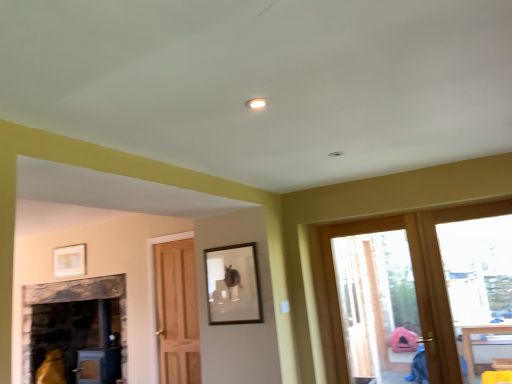
How much space does matte black picture frame at center, which ranks as the 2th picture frame in left-to-right order, occupy horizontally?

4.21 centimeters.

You are a GUI agent. You are given a task and a screenshot of the screen. Output one action in this format:
    pyautogui.click(x=<x>, y=<y>)
    Task: Click on the matte white picture frame at upper left, the 2th picture frame viewed from the right
    
    Given the screenshot: What is the action you would take?
    pyautogui.click(x=69, y=260)

This screenshot has width=512, height=384. What do you see at coordinates (479, 287) in the screenshot? I see `clear glass door at right, positioned as the 1th window in right-to-left order` at bounding box center [479, 287].

Where is `matte black picture frame at center, the first picture frame viewed from the right`? The height and width of the screenshot is (384, 512). matte black picture frame at center, the first picture frame viewed from the right is located at coordinates (233, 284).

Is clear glass door at right, which is the 2th window in left-to-right order, positioned far away from matte white picture frame at upper left, marked as the 2th picture frame in a front-to-back arrangement?

Yes, clear glass door at right, which is the 2th window in left-to-right order, is far from matte white picture frame at upper left, marked as the 2th picture frame in a front-to-back arrangement.

Which object is closer to the camera, clear glass door at right, positioned as the 1th window in right-to-left order, or matte white picture frame at upper left, placed as the first picture frame when sorted from back to front?

clear glass door at right, positioned as the 1th window in right-to-left order.

Image resolution: width=512 pixels, height=384 pixels. Identify the location of picture frame that is below the clear glass door at right, positioned as the 1th window in right-to-left order (from the image's perspective). (69, 260).

Considering the relative positions of transparent glass door at right, acting as the second window starting from the right, and matte white picture frame at upper left, placed as the first picture frame when sorted from back to front, in the image provided, is transparent glass door at right, acting as the second window starting from the right, to the left of matte white picture frame at upper left, placed as the first picture frame when sorted from back to front, from the viewer's perspective?

In fact, transparent glass door at right, acting as the second window starting from the right, is to the right of matte white picture frame at upper left, placed as the first picture frame when sorted from back to front.

Between point (418, 317) and point (85, 250), which one is positioned behind?

The point (85, 250) is farther.

Consider the image. Is transparent glass door at right, acting as the second window starting from the right, smaller than matte white picture frame at upper left, the 2th picture frame viewed from the right?

Incorrect, transparent glass door at right, acting as the second window starting from the right, is not smaller in size than matte white picture frame at upper left, the 2th picture frame viewed from the right.

At what (x,y) coordinates should I click in order to perform the action: click on the 2nd picture frame to the left of the transparent glass door at right, acting as the second window starting from the right, counting from the anchor's position. Please return your answer as a coordinate pair (x, y). Looking at the image, I should click on 69,260.

From a real-world perspective, is matte white picture frame at upper left, placed as the first picture frame when sorted from back to front, above or below matte black picture frame at center, the first picture frame viewed from the right?

matte white picture frame at upper left, placed as the first picture frame when sorted from back to front, is situated higher than matte black picture frame at center, the first picture frame viewed from the right, in the real world.

Consider the image. From their relative heights in the image, would you say matte white picture frame at upper left, which is counted as the 1th picture frame, starting from the left, is taller or shorter than matte black picture frame at center, the first picture frame viewed from the right?

In the image, matte white picture frame at upper left, which is counted as the 1th picture frame, starting from the left, appears to be shorter than matte black picture frame at center, the first picture frame viewed from the right.

Could you tell me if matte white picture frame at upper left, marked as the 2th picture frame in a front-to-back arrangement, is facing matte black picture frame at center, the first picture frame viewed from the right?

No, matte white picture frame at upper left, marked as the 2th picture frame in a front-to-back arrangement, is not turned towards matte black picture frame at center, the first picture frame viewed from the right.

Is matte white picture frame at upper left, the 2th picture frame viewed from the right, in contact with matte black picture frame at center, which ranks as the 2th picture frame in left-to-right order?

No, matte white picture frame at upper left, the 2th picture frame viewed from the right, is not with matte black picture frame at center, which ranks as the 2th picture frame in left-to-right order.

Who is bigger, matte white picture frame at upper left, placed as the first picture frame when sorted from back to front, or transparent glass door at right, acting as the second window starting from the right?

transparent glass door at right, acting as the second window starting from the right.

Considering the sizes of objects matte white picture frame at upper left, marked as the 2th picture frame in a front-to-back arrangement, and transparent glass door at right, acting as the second window starting from the right, in the image provided, who is thinner, matte white picture frame at upper left, marked as the 2th picture frame in a front-to-back arrangement, or transparent glass door at right, acting as the second window starting from the right,?

matte white picture frame at upper left, marked as the 2th picture frame in a front-to-back arrangement.

Based on the photo, is matte white picture frame at upper left, which is counted as the 1th picture frame, starting from the left, at the left side of transparent glass door at right, acting as the second window starting from the right?

Indeed, matte white picture frame at upper left, which is counted as the 1th picture frame, starting from the left, is positioned on the left side of transparent glass door at right, acting as the second window starting from the right.

Is matte white picture frame at upper left, marked as the 2th picture frame in a front-to-back arrangement, facing away from transparent glass door at right, acting as the second window starting from the right?

No, matte white picture frame at upper left, marked as the 2th picture frame in a front-to-back arrangement,'s orientation is not away from transparent glass door at right, acting as the second window starting from the right.

Is the depth of matte black picture frame at center, the first picture frame viewed from the right, less than that of matte white picture frame at upper left, the 2th picture frame viewed from the right?

Result: Yes, matte black picture frame at center, the first picture frame viewed from the right, is closer to the camera.

Is matte black picture frame at center, the second picture frame from the back, positioned far away from matte white picture frame at upper left, which is counted as the 1th picture frame, starting from the left?

matte black picture frame at center, the second picture frame from the back, is far away from matte white picture frame at upper left, which is counted as the 1th picture frame, starting from the left.

Based on the photo, is matte black picture frame at center, the first picture frame viewed from the right, to the left or to the right of matte white picture frame at upper left, marked as the 2th picture frame in a front-to-back arrangement, in the image?

In the image, matte black picture frame at center, the first picture frame viewed from the right, appears on the right side of matte white picture frame at upper left, marked as the 2th picture frame in a front-to-back arrangement.

From a real-world perspective, which is physically below, matte black picture frame at center, the second picture frame from the back, or matte white picture frame at upper left, which is counted as the 1th picture frame, starting from the left?

matte black picture frame at center, the second picture frame from the back, from a real-world perspective.

Is the position of transparent glass door at right, acting as the second window starting from the right, less distant than that of clear glass door at right, which is the 2th window in left-to-right order?

Yes, transparent glass door at right, acting as the second window starting from the right, is closer to the camera.

Is transparent glass door at right, the first window from the left, facing towards clear glass door at right, which is the 2th window in left-to-right order?

Yes, transparent glass door at right, the first window from the left, is facing clear glass door at right, which is the 2th window in left-to-right order.

Which is more to the left, transparent glass door at right, the first window from the left, or clear glass door at right, positioned as the 1th window in right-to-left order?

From the viewer's perspective, transparent glass door at right, the first window from the left, appears more on the left side.

I want to click on window above the clear glass door at right, which is the 2th window in left-to-right order (from a real-world perspective), so click(x=414, y=292).

In terms of height, does clear glass door at right, positioned as the 1th window in right-to-left order, look taller or shorter compared to transparent glass door at right, the first window from the left?

clear glass door at right, positioned as the 1th window in right-to-left order, is shorter than transparent glass door at right, the first window from the left.

Considering the positions of objects clear glass door at right, which is the 2th window in left-to-right order, and transparent glass door at right, acting as the second window starting from the right, in the image provided, who is in front, clear glass door at right, which is the 2th window in left-to-right order, or transparent glass door at right, acting as the second window starting from the right,?

transparent glass door at right, acting as the second window starting from the right.

Could you measure the distance between clear glass door at right, positioned as the 1th window in right-to-left order, and transparent glass door at right, the first window from the left?

2.76 meters.

Where is `the 2nd picture frame counting from the left of the clear glass door at right, positioned as the 1th window in right-to-left order`? the 2nd picture frame counting from the left of the clear glass door at right, positioned as the 1th window in right-to-left order is located at coordinates (69, 260).

I want to click on window that is the 1st object directly below the matte white picture frame at upper left, marked as the 2th picture frame in a front-to-back arrangement (from a real-world perspective), so click(414, 292).

When comparing their distances from matte black picture frame at center, the first picture frame viewed from the right, does matte white picture frame at upper left, which is counted as the 1th picture frame, starting from the left, or clear glass door at right, positioned as the 1th window in right-to-left order, seem closer?

clear glass door at right, positioned as the 1th window in right-to-left order, lies closer to matte black picture frame at center, the first picture frame viewed from the right, than the other object.

Considering their positions, is clear glass door at right, which is the 2th window in left-to-right order, positioned further to matte white picture frame at upper left, which is counted as the 1th picture frame, starting from the left, than transparent glass door at right, the first window from the left?

The object further to matte white picture frame at upper left, which is counted as the 1th picture frame, starting from the left, is clear glass door at right, which is the 2th window in left-to-right order.

Looking at the image, which one is located further to transparent glass door at right, acting as the second window starting from the right, matte white picture frame at upper left, the 2th picture frame viewed from the right, or matte black picture frame at center, the first picture frame viewed from the right?

matte white picture frame at upper left, the 2th picture frame viewed from the right.

Looking at this image, when comparing their distances from clear glass door at right, positioned as the 1th window in right-to-left order, does transparent glass door at right, acting as the second window starting from the right, or matte white picture frame at upper left, the 2th picture frame viewed from the right, seem closer?

The object closer to clear glass door at right, positioned as the 1th window in right-to-left order, is transparent glass door at right, acting as the second window starting from the right.

Based on their spatial positions, is clear glass door at right, positioned as the 1th window in right-to-left order, or matte black picture frame at center, the second picture frame from the back, closer to matte white picture frame at upper left, marked as the 2th picture frame in a front-to-back arrangement?

matte black picture frame at center, the second picture frame from the back, is closer to matte white picture frame at upper left, marked as the 2th picture frame in a front-to-back arrangement.

Based on their spatial positions, is transparent glass door at right, the first window from the left, or clear glass door at right, positioned as the 1th window in right-to-left order, closer to matte black picture frame at center, the second picture frame from the back?

clear glass door at right, positioned as the 1th window in right-to-left order, lies closer to matte black picture frame at center, the second picture frame from the back, than the other object.

Based on their spatial positions, is clear glass door at right, positioned as the 1th window in right-to-left order, or matte white picture frame at upper left, which is counted as the 1th picture frame, starting from the left, closer to transparent glass door at right, acting as the second window starting from the right?

clear glass door at right, positioned as the 1th window in right-to-left order.

Which object lies further to the anchor point matte white picture frame at upper left, placed as the first picture frame when sorted from back to front, transparent glass door at right, the first window from the left, or matte black picture frame at center, the second picture frame from the back?

transparent glass door at right, the first window from the left, lies further to matte white picture frame at upper left, placed as the first picture frame when sorted from back to front, than the other object.

At what (x,y) coordinates should I click in order to perform the action: click on picture frame between matte white picture frame at upper left, marked as the 2th picture frame in a front-to-back arrangement, and transparent glass door at right, the first window from the left. Please return your answer as a coordinate pair (x, y). Looking at the image, I should click on (233, 284).

Identify the location of window between matte white picture frame at upper left, placed as the first picture frame when sorted from back to front, and clear glass door at right, which is the 2th window in left-to-right order, from left to right. (414, 292).

Find the location of `picture frame between matte white picture frame at upper left, which is counted as the 1th picture frame, starting from the left, and clear glass door at right, which is the 2th window in left-to-right order, from left to right`. picture frame between matte white picture frame at upper left, which is counted as the 1th picture frame, starting from the left, and clear glass door at right, which is the 2th window in left-to-right order, from left to right is located at coordinates (233, 284).

This screenshot has width=512, height=384. What are the coordinates of `window located between matte black picture frame at center, which appears as the 1th picture frame when viewed from the front, and clear glass door at right, which is the 2th window in left-to-right order, in the left-right direction` in the screenshot? It's located at click(414, 292).